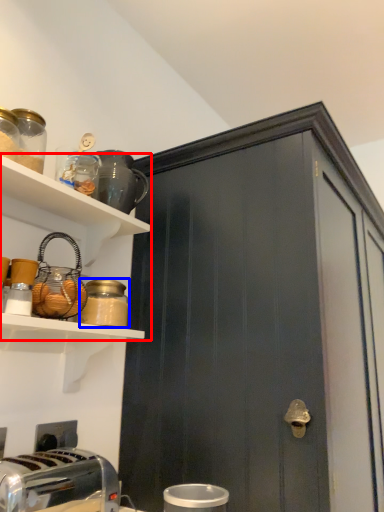
Question: Among these objects, which one is nearest to the camera, shelf (highlighted by a red box) or bottle (highlighted by a blue box)?

Choices:
 (A) shelf
 (B) bottle

Answer: (A)